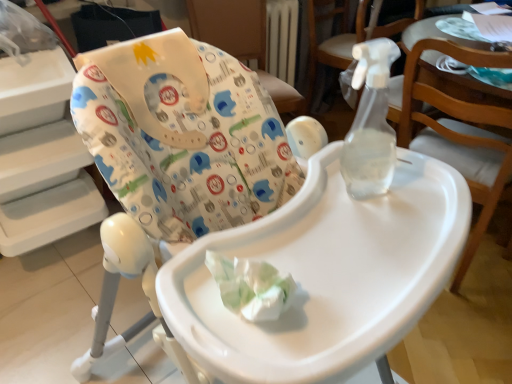
Question: From a real-world perspective, is transparent plastic spray bottle at upper right, the 2th chair positioned from the back, under transparent plastic spray bottle at upper right, the second chair positioned from the front?

Choices:
 (A) no
 (B) yes

Answer: (B)

Question: Is transparent plastic spray bottle at upper right, the third chair from the front, outside transparent plastic spray bottle at upper right, the third chair positioned from the back?

Choices:
 (A) no
 (B) yes

Answer: (B)

Question: Is transparent plastic spray bottle at upper right, the 2th chair positioned from the back, wider than transparent plastic spray bottle at upper right, the second chair positioned from the front?

Choices:
 (A) yes
 (B) no

Answer: (B)

Question: Is transparent plastic spray bottle at upper right, the third chair from the front, looking in the opposite direction of transparent plastic spray bottle at upper right, the second chair positioned from the front?

Choices:
 (A) yes
 (B) no

Answer: (B)

Question: Could you tell me if transparent plastic spray bottle at upper right, the 2th chair positioned from the back, is facing transparent plastic spray bottle at upper right, the second chair positioned from the front?

Choices:
 (A) yes
 (B) no

Answer: (B)

Question: From a real-world perspective, is white fabric highchair at upper center, the 4th chair in the front-to-back sequence, positioned above or below transparent plastic spray bottle at upper right, the second chair positioned from the front?

Choices:
 (A) below
 (B) above

Answer: (B)

Question: Looking at their shapes, would you say white fabric highchair at upper center, which is counted as the 1th chair, starting from the back, is wider or thinner than transparent plastic spray bottle at upper right, the second chair positioned from the front?

Choices:
 (A) thin
 (B) wide

Answer: (A)

Question: Is white fabric highchair at upper center, the 4th chair in the front-to-back sequence, taller or shorter than transparent plastic spray bottle at upper right, the third chair positioned from the back?

Choices:
 (A) short
 (B) tall

Answer: (A)

Question: From the image's perspective, is white fabric highchair at upper center, which is counted as the 1th chair, starting from the back, above or below transparent plastic spray bottle at upper right, the third chair positioned from the back?

Choices:
 (A) below
 (B) above

Answer: (B)

Question: Looking at their shapes, would you say transparent plastic spray bottle at upper right, the 2th chair positioned from the back, is wider or thinner than white plastic highchair at center, the first chair when ordered from front to back?

Choices:
 (A) thin
 (B) wide

Answer: (A)

Question: Is transparent plastic spray bottle at upper right, the third chair from the front, taller or shorter than white plastic highchair at center, the first chair when ordered from front to back?

Choices:
 (A) tall
 (B) short

Answer: (B)

Question: Would you say transparent plastic spray bottle at upper right, the third chair from the front, is to the left or to the right of white plastic highchair at center, the 4th chair positioned from the back, in the picture?

Choices:
 (A) left
 (B) right

Answer: (B)

Question: Considering the positions of transparent plastic spray bottle at upper right, the 2th chair positioned from the back, and white plastic highchair at center, the 4th chair positioned from the back, in the image, is transparent plastic spray bottle at upper right, the 2th chair positioned from the back, bigger or smaller than white plastic highchair at center, the 4th chair positioned from the back,?

Choices:
 (A) big
 (B) small

Answer: (B)

Question: Do you think transparent plastic spray bottle at upper right, the third chair from the front, is within white fabric highchair at upper center, which is counted as the 1th chair, starting from the back, or outside of it?

Choices:
 (A) outside
 (B) inside

Answer: (A)

Question: Considering the positions of transparent plastic spray bottle at upper right, the 2th chair positioned from the back, and white fabric highchair at upper center, the 4th chair in the front-to-back sequence, in the image, is transparent plastic spray bottle at upper right, the 2th chair positioned from the back, taller or shorter than white fabric highchair at upper center, the 4th chair in the front-to-back sequence,?

Choices:
 (A) tall
 (B) short

Answer: (A)